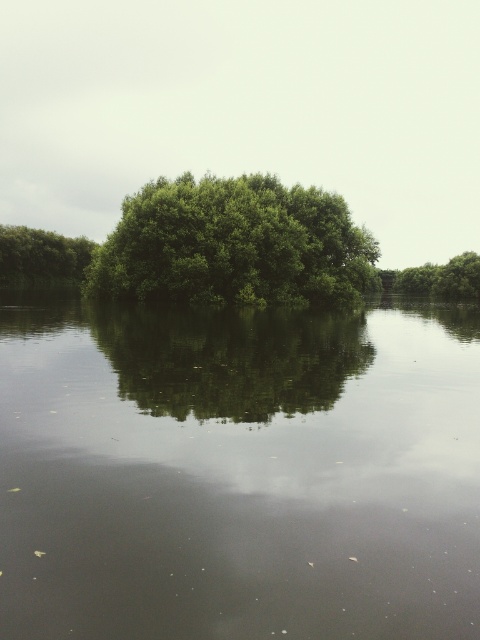
Measure the distance between green reflective water at center and camera.

The distance of green reflective water at center from camera is 3.63 meters.

Between green reflective water at center and green leafy tree at center, which one appears on the left side from the viewer's perspective?

From the viewer's perspective, green reflective water at center appears more on the left side.

Who is more distant from viewer, (256,355) or (317,253)?

Positioned behind is point (317,253).

Find the location of a particular element. The width and height of the screenshot is (480, 640). green reflective water at center is located at coordinates (238, 470).

Looking at this image, can you confirm if green leafy tree at center is wider than green leafy tree at upper right?

Yes.

Is green leafy tree at center shorter than green leafy tree at upper right?

No, green leafy tree at center is not shorter than green leafy tree at upper right.

Between point (204, 193) and point (431, 292), which one is positioned in front?

Positioned in front is point (204, 193).

This screenshot has width=480, height=640. Identify the location of green leafy tree at center. (233, 244).

Between green reflective water at center and green leafy tree at left, which one has more height?

Standing taller between the two is green leafy tree at left.

Can you confirm if green reflective water at center is shorter than green leafy tree at left?

Yes, green reflective water at center is shorter than green leafy tree at left.

In order to click on green reflective water at center in this screenshot , I will do `click(238, 470)`.

At what (x,y) coordinates should I click in order to perform the action: click on green reflective water at center. Please return your answer as a coordinate pair (x, y). This screenshot has height=640, width=480. Looking at the image, I should click on (238, 470).